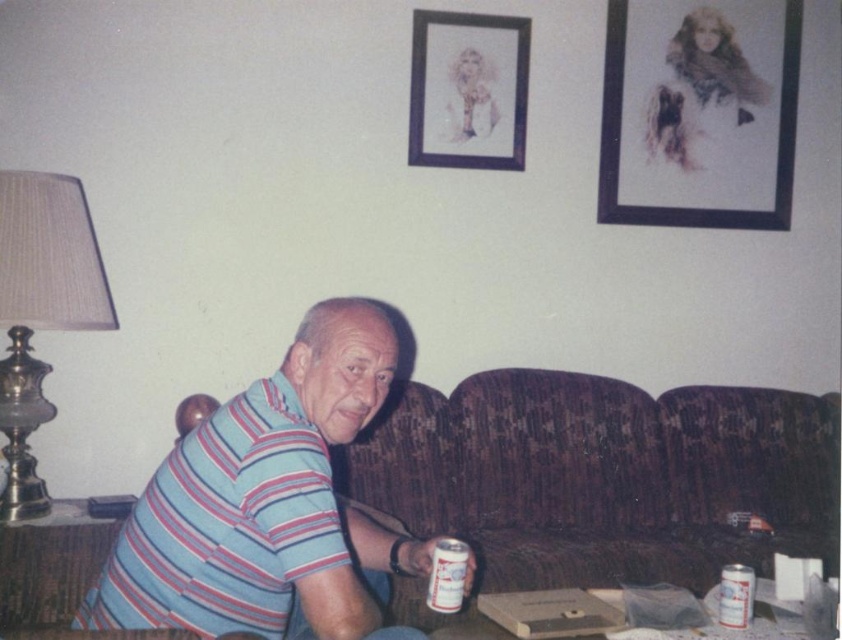
You are a guest in this living room and see the white matte can at lower center and the white matte can at lower right. Which can is closer to you?

The white matte can at lower center is closer to you because it is in front of the white matte can at lower right.

You are organizing a party and need to place decorations. You have a black paper at upper right and a white matte can at lower center. Which object is placed above the other?

The black paper at upper right is positioned over white matte can at lower center, so it is placed above the white matte can at lower center.